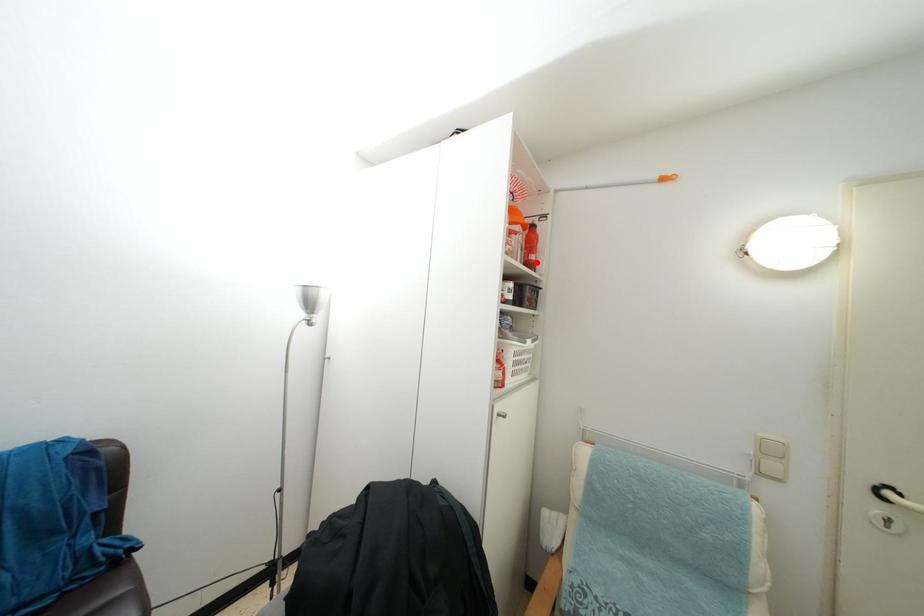
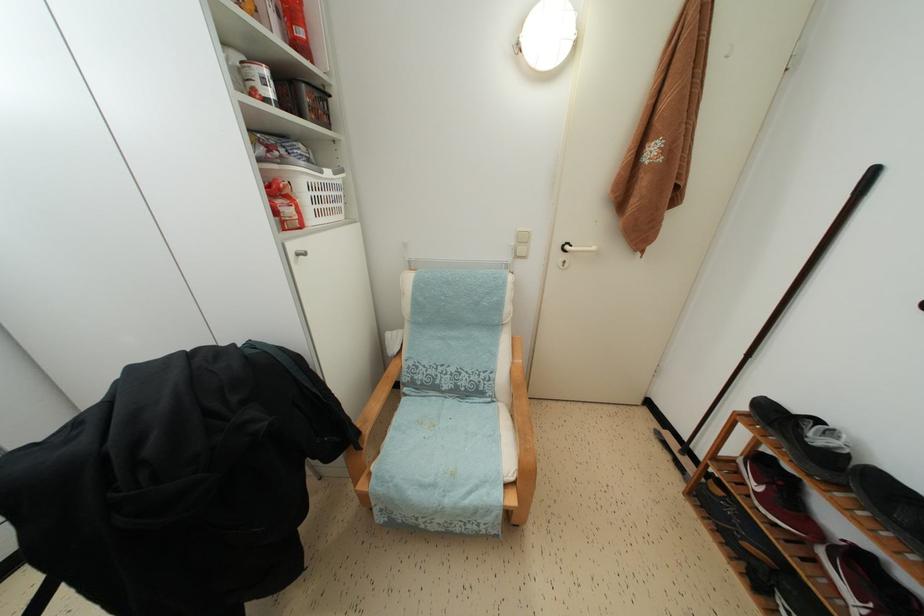
The point at the highlighted location is marked in the first image. Where is the corresponding point in the second image?

(305, 38)